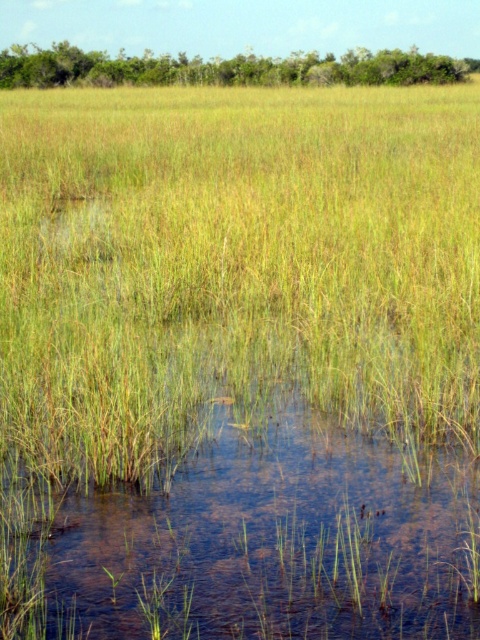
You are standing at the point labeled point (79, 67) in the wetland scene. If you look towards the direction of point (314, 577), which point would appear closer to you?

Point (314, 577) is in front of point (79, 67), so when looking in that direction, point (314, 577) would appear closer to you.

From the picture: You are standing at the edge of the wetland and want to walk towards the clear water at center. However, there is green grass at upper center in your path. Based on their positions, which object will you encounter first?

You will encounter the clear water at center first because it is closer to you than the green grass at upper center.